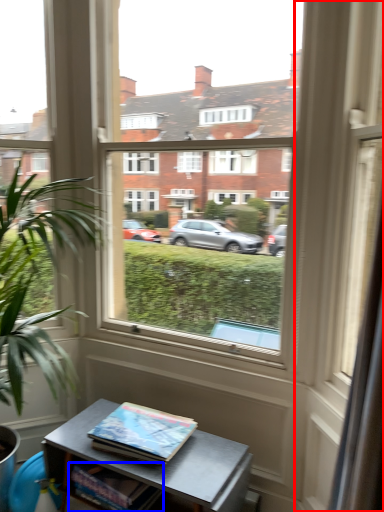
Question: Which of the following is the farthest to the observer, glass door (highlighted by a red box) or book (highlighted by a blue box)?

Choices:
 (A) glass door
 (B) book

Answer: (B)